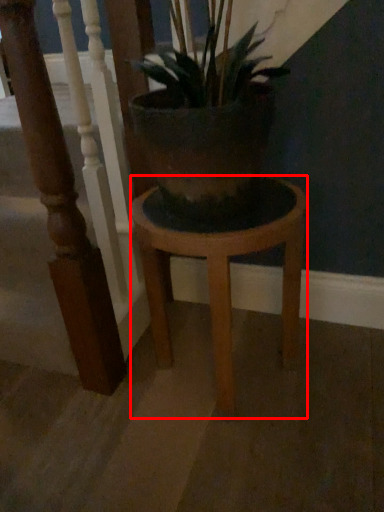
Question: From the image's perspective, where is stool (annotated by the red box) located relative to rail?

Choices:
 (A) above
 (B) below

Answer: (B)